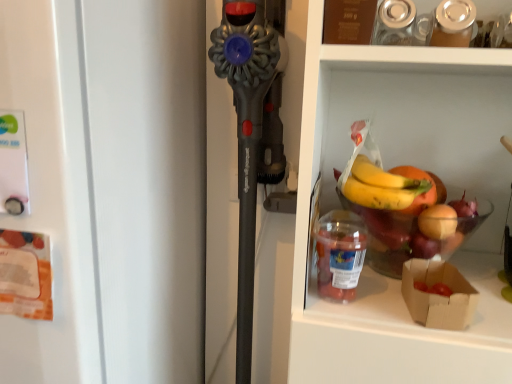
This screenshot has height=384, width=512. I want to click on white matte refrigerator at left, so click(111, 186).

Looking at this image, in order to face brown paper bag at lower right, should I rotate leftwards or rightwards?

You should rotate right by 22.209 degrees.

Find the location of `brown paper bag at lower right`. brown paper bag at lower right is located at coordinates (438, 295).

At what (x,y) coordinates should I click in order to perform the action: click on white matte refrigerator at left. Please return your answer as a coordinate pair (x, y). Looking at the image, I should click on (111, 186).

From the image's perspective, is white matte refrigerator at left above or below brown paper bag at lower right?

Clearly, from the image's perspective, white matte refrigerator at left is below brown paper bag at lower right.

Is white matte refrigerator at left at the left side of brown paper bag at lower right?

Yes.

Which object is closer to the camera, white matte refrigerator at left or brown paper bag at lower right?

white matte refrigerator at left is in front.

Looking at this image, considering the relative sizes of white matte refrigerator at left and brown paper bag at lower right in the image provided, is white matte refrigerator at left bigger than brown paper bag at lower right?

Yes, white matte refrigerator at left is bigger than brown paper bag at lower right.

From the image's perspective, which one is positioned lower, brown paper bag at lower right or white matte refrigerator at left?

From the image's view, white matte refrigerator at left is below.

This screenshot has height=384, width=512. What are the coordinates of `box above the white matte refrigerator at left (from the image's perspective)` in the screenshot? It's located at (438, 295).

Is brown paper bag at lower right directly adjacent to white matte refrigerator at left?

No, brown paper bag at lower right is not beside white matte refrigerator at left.

Does point (417, 279) appear closer or farther from the camera than point (106, 96)?

Point (417, 279) is positioned farther from the camera compared to point (106, 96).

Locate an element on the screen. bottle on the right side of white matte refrigerator at left is located at coordinates (340, 254).

Is point (324, 223) closer or farther from the camera than point (11, 65)?

Point (324, 223) is positioned farther from the camera compared to point (11, 65).

Can you confirm if translucent plastic container at lower right is positioned to the right of white matte refrigerator at left?

Yes, translucent plastic container at lower right is to the right of white matte refrigerator at left.

Considering the relative sizes of translucent plastic container at lower right and white matte refrigerator at left in the image provided, is translucent plastic container at lower right wider than white matte refrigerator at left?

Incorrect, the width of translucent plastic container at lower right does not surpass that of white matte refrigerator at left.

Relative to brown paper bag at lower right, is translucent plastic container at lower right in front or behind?

translucent plastic container at lower right is behind brown paper bag at lower right.

Which is more to the right, translucent plastic container at lower right or brown paper bag at lower right?

From the viewer's perspective, brown paper bag at lower right appears more on the right side.

Considering the sizes of objects translucent plastic container at lower right and brown paper bag at lower right in the image provided, who is wider, translucent plastic container at lower right or brown paper bag at lower right?

brown paper bag at lower right.

This screenshot has width=512, height=384. Find the location of `box in front of the translucent plastic container at lower right`. box in front of the translucent plastic container at lower right is located at coordinates (438, 295).

Looking at the image, does white matte refrigerator at left seem bigger or smaller compared to translucent plastic container at lower right?

In the image, white matte refrigerator at left appears to be larger than translucent plastic container at lower right.

Is white matte refrigerator at left closer to camera compared to translucent plastic container at lower right?

Yes, the depth of white matte refrigerator at left is less than that of translucent plastic container at lower right.

Are white matte refrigerator at left and translucent plastic container at lower right beside each other?

No, white matte refrigerator at left is not with translucent plastic container at lower right.

In the scene shown: From the image's perspective, which one is positioned lower, white matte refrigerator at left or translucent plastic container at lower right?

From the image's view, white matte refrigerator at left is below.

Is brown paper bag at lower right facing away from translucent plastic container at lower right?

No, brown paper bag at lower right's orientation is not away from translucent plastic container at lower right.

From the picture: From a real-world perspective, is brown paper bag at lower right positioned over translucent plastic container at lower right based on gravity?

No, from a real-world perspective, brown paper bag at lower right is not above translucent plastic container at lower right.

From the picture: Considering the relative positions of brown paper bag at lower right and translucent plastic container at lower right in the image provided, is brown paper bag at lower right to the left or to the right of translucent plastic container at lower right?

From the image, it's evident that brown paper bag at lower right is to the right of translucent plastic container at lower right.

Would you say brown paper bag at lower right is outside translucent plastic container at lower right?

That's correct, brown paper bag at lower right is outside of translucent plastic container at lower right.

Where is `refrigerator below the brown paper bag at lower right (from the image's perspective)`? This screenshot has height=384, width=512. refrigerator below the brown paper bag at lower right (from the image's perspective) is located at coordinates (111, 186).

This screenshot has height=384, width=512. In order to click on box located behind the white matte refrigerator at left in this screenshot , I will do `click(438, 295)`.

Looking at the image, which one is located closer to translucent plastic container at lower right, white matte refrigerator at left or brown paper bag at lower right?

brown paper bag at lower right.

From the image, which object appears to be nearer to white matte refrigerator at left, brown paper bag at lower right or translucent plastic container at lower right?

The object closer to white matte refrigerator at left is translucent plastic container at lower right.

Estimate the real-world distances between objects in this image. Which object is closer to brown paper bag at lower right, translucent plastic container at lower right or white matte refrigerator at left?

translucent plastic container at lower right is positioned closer to the anchor brown paper bag at lower right.

From the picture: Estimate the real-world distances between objects in this image. Which object is closer to translucent plastic container at lower right, brown paper bag at lower right or white matte refrigerator at left?

Based on the image, brown paper bag at lower right appears to be nearer to translucent plastic container at lower right.

From the image, which object appears to be nearer to brown paper bag at lower right, white matte refrigerator at left or translucent plastic container at lower right?

translucent plastic container at lower right is closer to brown paper bag at lower right.

Based on their spatial positions, is translucent plastic container at lower right or brown paper bag at lower right closer to white matte refrigerator at left?

translucent plastic container at lower right is positioned closer to the anchor white matte refrigerator at left.

Image resolution: width=512 pixels, height=384 pixels. Find the location of `bottle between white matte refrigerator at left and brown paper bag at lower right`. bottle between white matte refrigerator at left and brown paper bag at lower right is located at coordinates (340, 254).